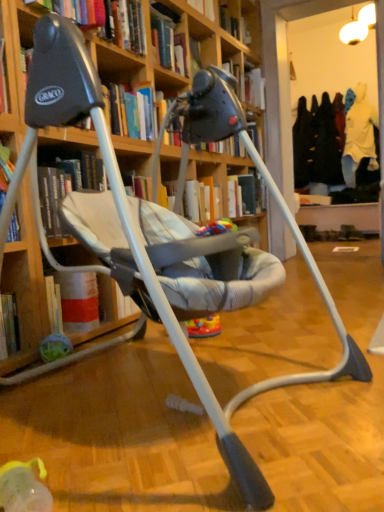
The height and width of the screenshot is (512, 384). In order to click on free space below wooden bookcase at center (from a real-world perspective) in this screenshot , I will do `click(179, 390)`.